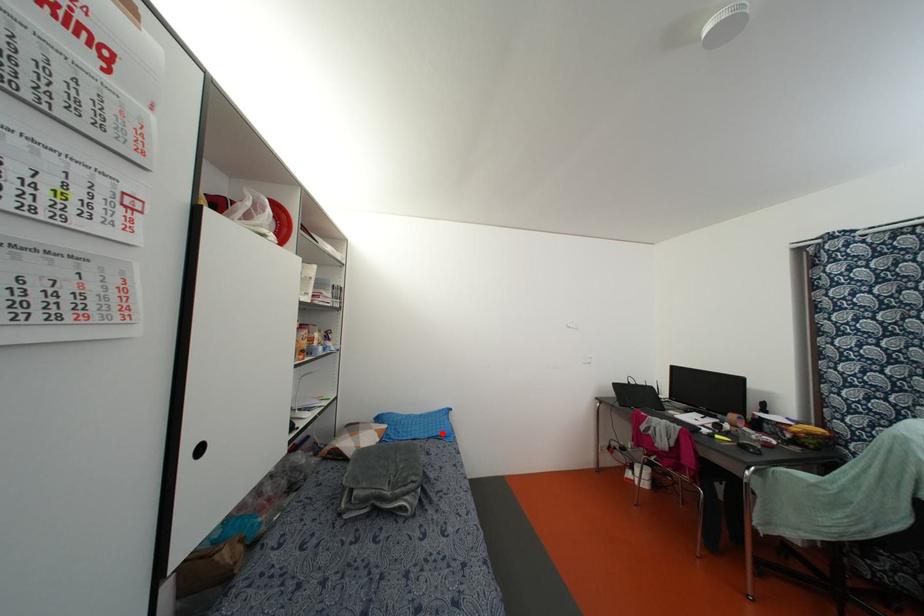
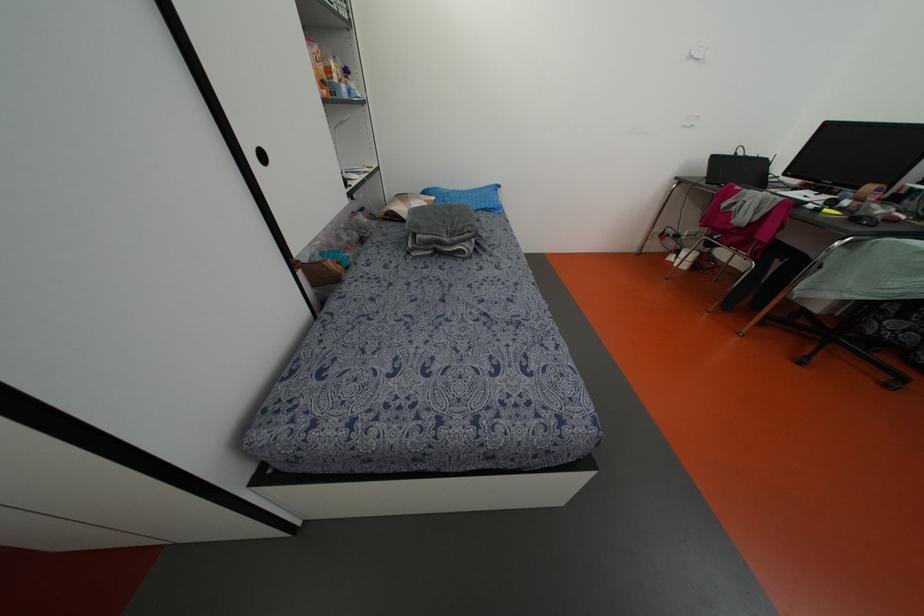
Question: A red point is marked in image1. In image2, is the corresponding 3D point closer to the camera or farther? Reply with the corresponding letter.

Choices:
 (A) The corresponding 3D point is closer.
 (B) The corresponding 3D point is farther.

Answer: (A)